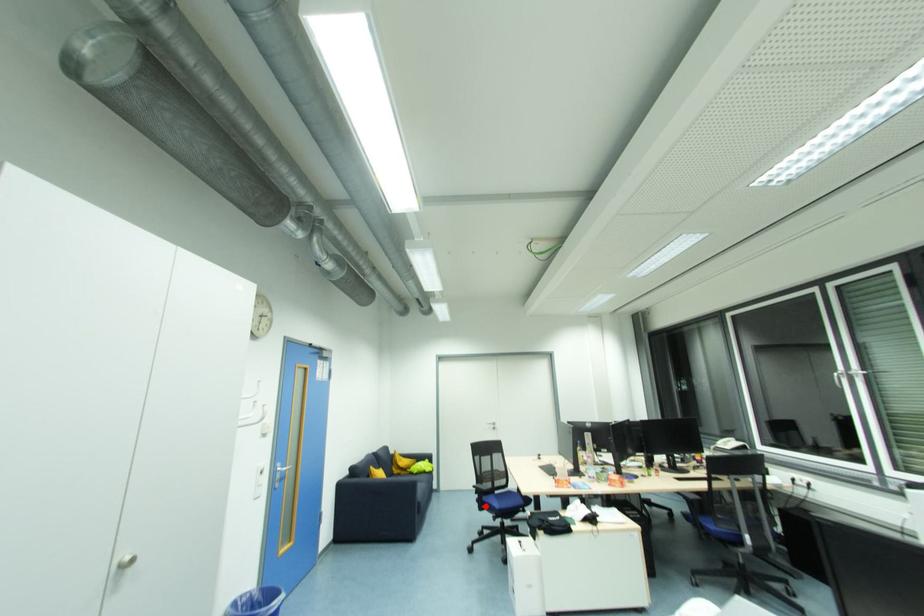
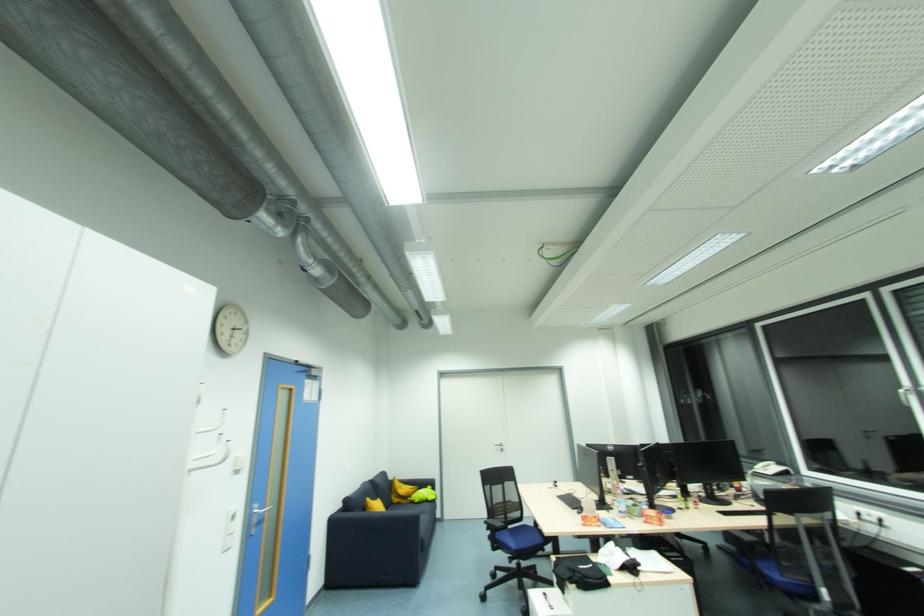
Locate, in the second image, the point that corresponds to the highlighted location in the first image.

(497, 546)